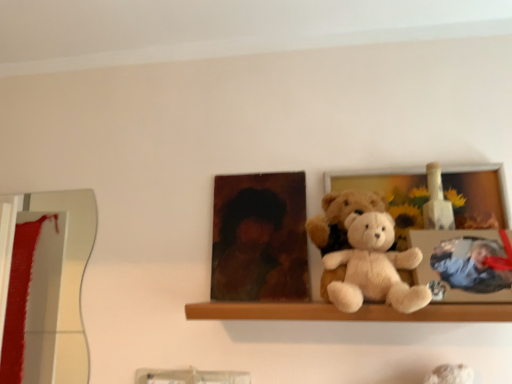
Image resolution: width=512 pixels, height=384 pixels. In order to click on wooden shelf at center in this screenshot , I will do tap(347, 313).

What do you see at coordinates (374, 267) in the screenshot? The image size is (512, 384). I see `white plush teddy bear at center, which ranks as the 1th teddy bear in front-to-back order` at bounding box center [374, 267].

I want to click on fluffy beige teddy bear at center, marked as the 2th teddy bear in a front-to-back arrangement, so click(339, 218).

From the picture: Is fluffy beige teddy bear at center, arranged as the first teddy bear when viewed from the back, directly adjacent to wooden shelf at center?

fluffy beige teddy bear at center, arranged as the first teddy bear when viewed from the back, and wooden shelf at center are clearly separated.

Between fluffy beige teddy bear at center, arranged as the first teddy bear when viewed from the back, and wooden shelf at center, which one is positioned in front?

wooden shelf at center is closer to the camera.

Who is shorter, fluffy beige teddy bear at center, arranged as the first teddy bear when viewed from the back, or wooden shelf at center?

With less height is wooden shelf at center.

This screenshot has height=384, width=512. I want to click on window sill that appears on the right of matte brown portrait at center, so click(347, 313).

Can you confirm if wooden shelf at center is positioned to the left of matte brown portrait at center?

Incorrect, wooden shelf at center is not on the left side of matte brown portrait at center.

Looking at this image, does wooden shelf at center have a larger size compared to matte brown portrait at center?

Yes, wooden shelf at center is bigger than matte brown portrait at center.

Considering the sizes of objects wooden shelf at center and matte brown portrait at center in the image provided, who is wider, wooden shelf at center or matte brown portrait at center?

wooden shelf at center is wider.

Between white plush teddy bear at center, arranged as the second teddy bear when viewed from the back, and fluffy beige teddy bear at center, arranged as the first teddy bear when viewed from the back, which one has larger width?

With larger width is white plush teddy bear at center, arranged as the second teddy bear when viewed from the back.

Considering the sizes of white plush teddy bear at center, arranged as the second teddy bear when viewed from the back, and fluffy beige teddy bear at center, marked as the 2th teddy bear in a front-to-back arrangement, in the image, is white plush teddy bear at center, arranged as the second teddy bear when viewed from the back, taller or shorter than fluffy beige teddy bear at center, marked as the 2th teddy bear in a front-to-back arrangement,?

In the image, white plush teddy bear at center, arranged as the second teddy bear when viewed from the back, appears to be shorter than fluffy beige teddy bear at center, marked as the 2th teddy bear in a front-to-back arrangement.

In the scene shown: From a real-world perspective, is white plush teddy bear at center, which ranks as the 1th teddy bear in front-to-back order, physically located above or below fluffy beige teddy bear at center, arranged as the first teddy bear when viewed from the back?

From a real-world perspective, white plush teddy bear at center, which ranks as the 1th teddy bear in front-to-back order, is physically below fluffy beige teddy bear at center, arranged as the first teddy bear when viewed from the back.

From the image's perspective, is white plush teddy bear at center, which ranks as the 1th teddy bear in front-to-back order, positioned above or below fluffy beige teddy bear at center, marked as the 2th teddy bear in a front-to-back arrangement?

white plush teddy bear at center, which ranks as the 1th teddy bear in front-to-back order, is situated lower than fluffy beige teddy bear at center, marked as the 2th teddy bear in a front-to-back arrangement, in the image.

In terms of height, does wooden shelf at center look taller or shorter compared to wooden photo frame at center?

Considering their sizes, wooden shelf at center has less height than wooden photo frame at center.

Is wooden shelf at center wider or thinner than wooden photo frame at center?

Considering their sizes, wooden shelf at center looks broader than wooden photo frame at center.

Which point is more distant from viewer, (200,306) or (413,223)?

The point (413,223) is behind.

Which of these two, wooden shelf at center or wooden photo frame at center, is bigger?

With larger size is wooden shelf at center.

From the image's perspective, between white plush teddy bear at center, arranged as the second teddy bear when viewed from the back, and wooden photo frame at center, who is located below?

white plush teddy bear at center, arranged as the second teddy bear when viewed from the back, is shown below in the image.

This screenshot has height=384, width=512. I want to click on picture frame behind the white plush teddy bear at center, arranged as the second teddy bear when viewed from the back, so click(x=389, y=195).

Does point (355, 311) appear closer or farther from the camera than point (400, 218)?

Point (355, 311) appears to be closer to the viewer than point (400, 218).

Who is taller, white plush teddy bear at center, which ranks as the 1th teddy bear in front-to-back order, or wooden photo frame at center?

wooden photo frame at center.

In the image, is wooden shelf at center positioned in front of or behind fluffy beige teddy bear at center, arranged as the first teddy bear when viewed from the back?

In the image, wooden shelf at center appears in front of fluffy beige teddy bear at center, arranged as the first teddy bear when viewed from the back.

In the scene shown: From the image's perspective, is wooden shelf at center above fluffy beige teddy bear at center, marked as the 2th teddy bear in a front-to-back arrangement?

Actually, wooden shelf at center appears below fluffy beige teddy bear at center, marked as the 2th teddy bear in a front-to-back arrangement, in the image.

Is wooden shelf at center directly adjacent to fluffy beige teddy bear at center, marked as the 2th teddy bear in a front-to-back arrangement?

They are not placed beside each other.

At what (x,y) coordinates should I click in order to perform the action: click on teddy bear that is the 2nd one when counting forward from the matte brown portrait at center. Please return your answer as a coordinate pair (x, y). The image size is (512, 384). Looking at the image, I should click on (374, 267).

Can you confirm if matte brown portrait at center is taller than white plush teddy bear at center, which ranks as the 1th teddy bear in front-to-back order?

Indeed, matte brown portrait at center has a greater height compared to white plush teddy bear at center, which ranks as the 1th teddy bear in front-to-back order.

Is white plush teddy bear at center, which ranks as the 1th teddy bear in front-to-back order, located within matte brown portrait at center?

No, white plush teddy bear at center, which ranks as the 1th teddy bear in front-to-back order, is located outside of matte brown portrait at center.

In the scene shown: Measure the distance from matte brown portrait at center to white plush teddy bear at center, arranged as the second teddy bear when viewed from the back.

They are 9.82 inches apart.

Identify the location of window sill in front of the fluffy beige teddy bear at center, arranged as the first teddy bear when viewed from the back. (347, 313).

Find the location of a particular element. The height and width of the screenshot is (384, 512). person that appears above the wooden shelf at center (from the image's perspective) is located at coordinates (259, 249).

From the image, which object appears to be farther from fluffy beige teddy bear at center, marked as the 2th teddy bear in a front-to-back arrangement, matte brown portrait at center or wooden shelf at center?

The object further to fluffy beige teddy bear at center, marked as the 2th teddy bear in a front-to-back arrangement, is wooden shelf at center.

Estimate the real-world distances between objects in this image. Which object is closer to fluffy beige teddy bear at center, arranged as the first teddy bear when viewed from the back, wooden shelf at center or matte brown portrait at center?

matte brown portrait at center is positioned closer to the anchor fluffy beige teddy bear at center, arranged as the first teddy bear when viewed from the back.

Which object lies nearer to the anchor point fluffy beige teddy bear at center, arranged as the first teddy bear when viewed from the back, white plush teddy bear at center, arranged as the second teddy bear when viewed from the back, or wooden shelf at center?

Among the two, white plush teddy bear at center, arranged as the second teddy bear when viewed from the back, is located nearer to fluffy beige teddy bear at center, arranged as the first teddy bear when viewed from the back.

Estimate the real-world distances between objects in this image. Which object is further from wooden shelf at center, fluffy beige teddy bear at center, marked as the 2th teddy bear in a front-to-back arrangement, or white plush teddy bear at center, arranged as the second teddy bear when viewed from the back?

fluffy beige teddy bear at center, marked as the 2th teddy bear in a front-to-back arrangement.

When comparing their distances from fluffy beige teddy bear at center, marked as the 2th teddy bear in a front-to-back arrangement, does matte brown portrait at center or white plush teddy bear at center, which ranks as the 1th teddy bear in front-to-back order, seem further?

matte brown portrait at center is further to fluffy beige teddy bear at center, marked as the 2th teddy bear in a front-to-back arrangement.

Based on the photo, when comparing their distances from white plush teddy bear at center, arranged as the second teddy bear when viewed from the back, does fluffy beige teddy bear at center, arranged as the first teddy bear when viewed from the back, or wooden photo frame at center seem closer?

Among the two, fluffy beige teddy bear at center, arranged as the first teddy bear when viewed from the back, is located nearer to white plush teddy bear at center, arranged as the second teddy bear when viewed from the back.

When comparing their distances from wooden photo frame at center, does white plush teddy bear at center, arranged as the second teddy bear when viewed from the back, or wooden shelf at center seem further?

wooden shelf at center is positioned further to the anchor wooden photo frame at center.

Which object lies nearer to the anchor point matte brown portrait at center, wooden shelf at center or white plush teddy bear at center, which ranks as the 1th teddy bear in front-to-back order?

Based on the image, wooden shelf at center appears to be nearer to matte brown portrait at center.

Locate an element on the screen. The height and width of the screenshot is (384, 512). window sill between matte brown portrait at center and wooden photo frame at center in the horizontal direction is located at coordinates (347, 313).

Identify the location of teddy bear positioned between wooden shelf at center and matte brown portrait at center from near to far. (339, 218).

Where is `window sill located between white plush teddy bear at center, which ranks as the 1th teddy bear in front-to-back order, and fluffy beige teddy bear at center, arranged as the first teddy bear when viewed from the back, in the depth direction`? window sill located between white plush teddy bear at center, which ranks as the 1th teddy bear in front-to-back order, and fluffy beige teddy bear at center, arranged as the first teddy bear when viewed from the back, in the depth direction is located at coordinates (347, 313).

Locate an element on the screen. teddy bear located between white plush teddy bear at center, which ranks as the 1th teddy bear in front-to-back order, and matte brown portrait at center in the depth direction is located at coordinates (339, 218).